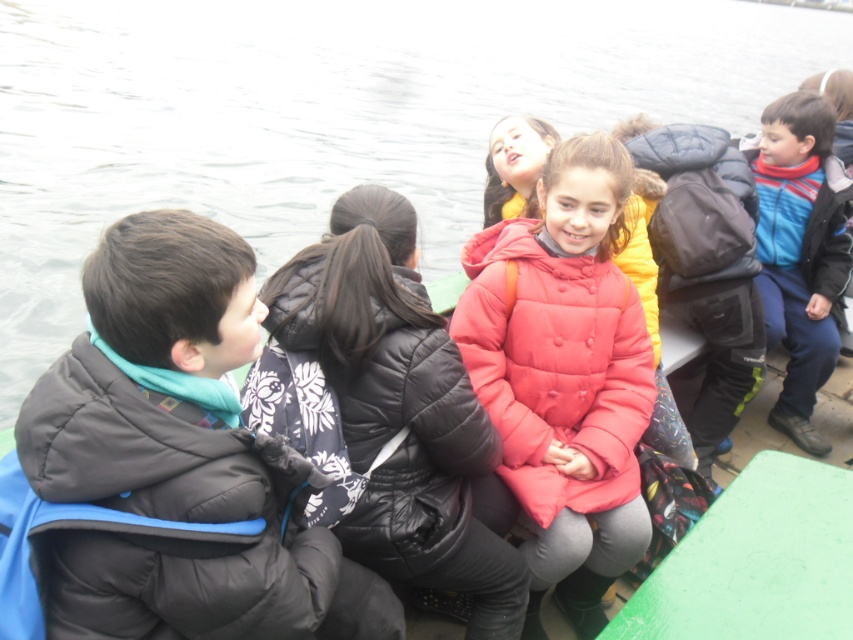
Can you confirm if matte black jacket at left is smaller than blue fleece jacket at right?

Incorrect, matte black jacket at left is not smaller in size than blue fleece jacket at right.

Does point (340, 636) lie in front of point (838, 230)?

Yes, point (340, 636) is in front of point (838, 230).

Which is behind, point (131, 266) or point (817, 195)?

Positioned behind is point (817, 195).

Identify the location of matte black jacket at left. The width and height of the screenshot is (853, 640). (178, 456).

Is transparent water at upper center to the left of matte black jacket at left from the viewer's perspective?

In fact, transparent water at upper center is to the right of matte black jacket at left.

Find the location of a particular element. transparent water at upper center is located at coordinates (328, 116).

You are a GUI agent. You are given a task and a screenshot of the screen. Output one action in this format:
    pyautogui.click(x=<x>, y=<y>)
    Task: Click on the transparent water at upper center
    This screenshot has height=640, width=853.
    Given the screenshot: What is the action you would take?
    pyautogui.click(x=328, y=116)

Based on the photo, who is taller, matte black jacket at left or puffy red jacket at center?

With more height is matte black jacket at left.

Describe the element at coordinates (178, 456) in the screenshot. I see `matte black jacket at left` at that location.

Based on the photo, who is more distant from viewer, [158,365] or [595,268]?

The point [595,268] is behind.

Where is `matte black jacket at left`? The height and width of the screenshot is (640, 853). matte black jacket at left is located at coordinates 178,456.